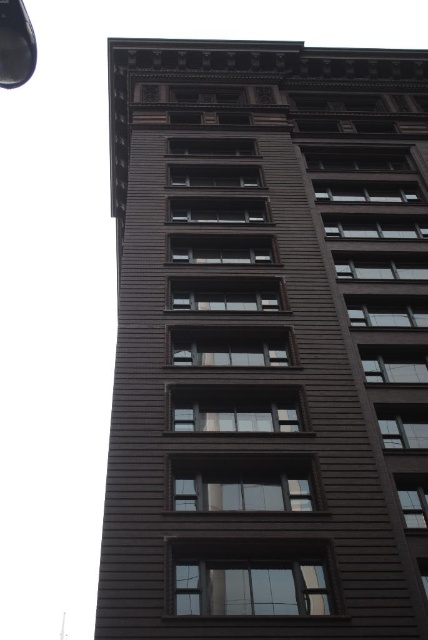
You are standing in front of a tall building with a symmetrical facade. You notice a specific point at coordinates (267, 342). Based on the description, what object or feature does this point most likely correspond to?

The point at coordinates (267, 342) corresponds to the brown wood grain building at center.

You are standing in front of a tall building and want to take a photo of the point at coordinates point (195, 81). Your camera has a maximum focus range of 50 meters. Will the camera be able to focus on the point?

The point (195, 81) is 53.86 meters from the camera, which exceeds the maximum focus range of 50 meters. Therefore, the camera will not be able to focus on the point.